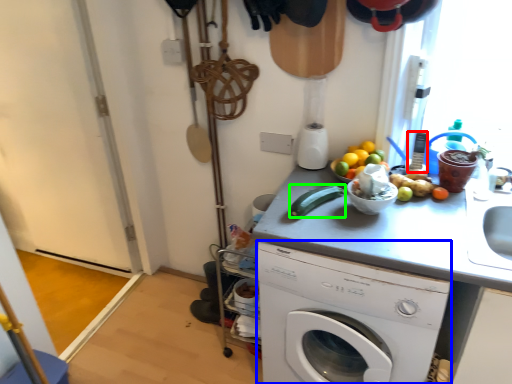
Question: Which object is the farthest from appliance (highlighted by a red box)? Choose among these: washing machine (highlighted by a blue box) or cucumber (highlighted by a green box).

Choices:
 (A) washing machine
 (B) cucumber

Answer: (A)